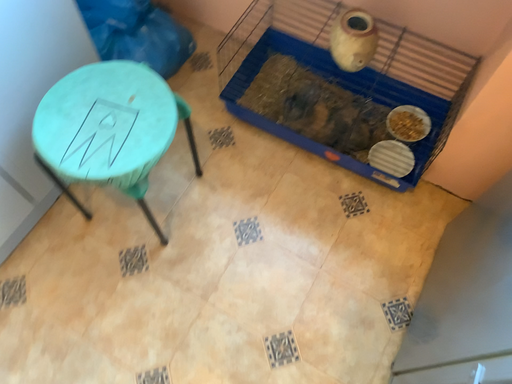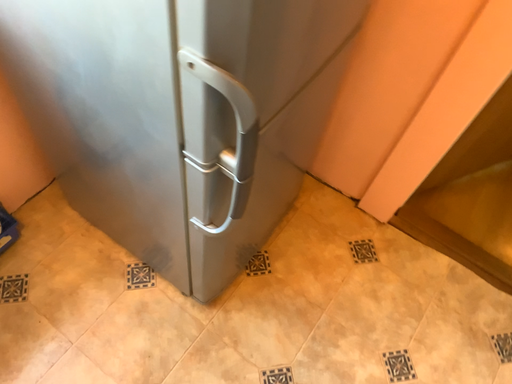
Question: How did the camera likely rotate when shooting the video?

Choices:
 (A) rotated downward
 (B) rotated upward

Answer: (B)